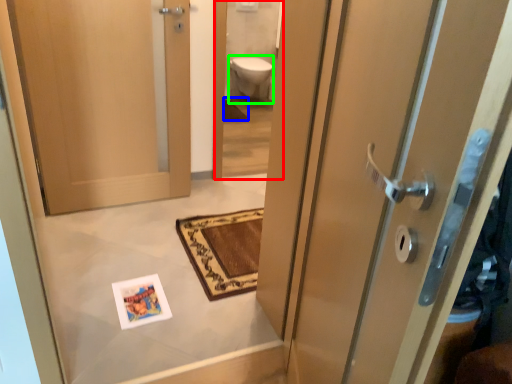
Question: Considering the real-world distances, which object is farthest from mirror (highlighted by a red box)? bath mat (highlighted by a blue box) or toilet bowl (highlighted by a green box)?

Choices:
 (A) bath mat
 (B) toilet bowl

Answer: (A)